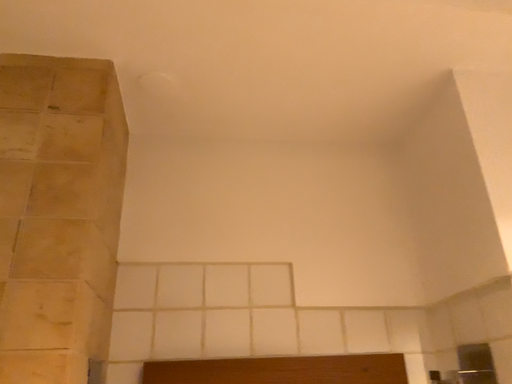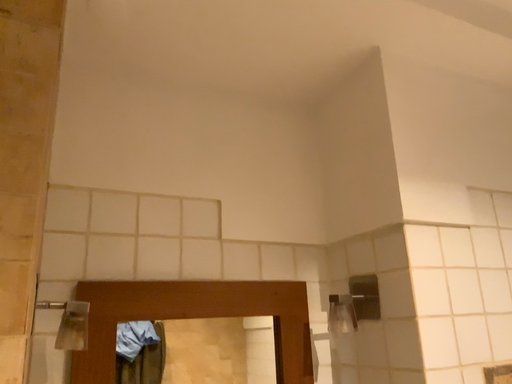
Question: Which way did the camera rotate in the video?

Choices:
 (A) rotated right
 (B) rotated left

Answer: (A)